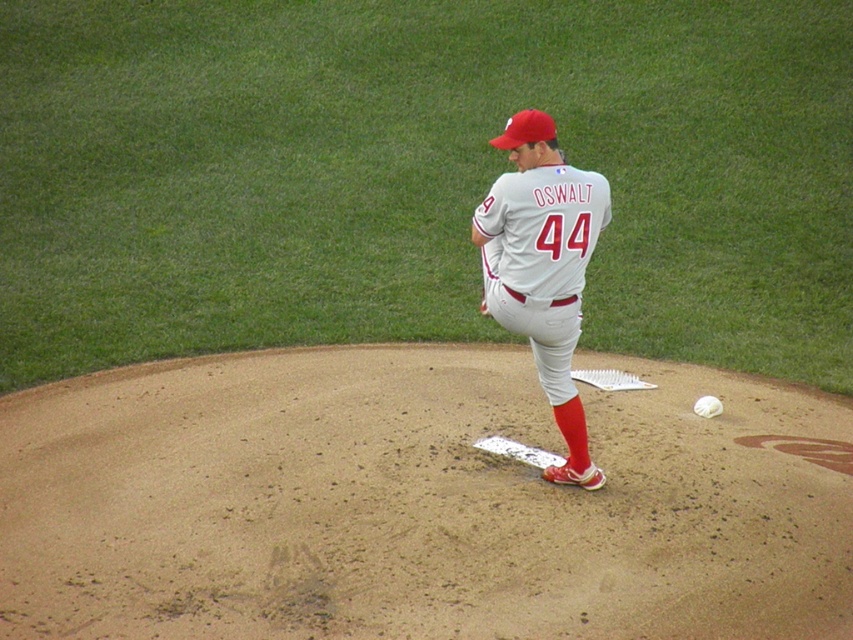
How much distance is there between brown dirt mound at center and white matte baseball at center?

The distance of brown dirt mound at center from white matte baseball at center is 1.86 meters.

Can you confirm if brown dirt mound at center is positioned to the left of white matte baseball at center?

Indeed, brown dirt mound at center is positioned on the left side of white matte baseball at center.

Describe the element at coordinates (416, 502) in the screenshot. Image resolution: width=853 pixels, height=640 pixels. I see `brown dirt mound at center` at that location.

Where is `brown dirt mound at center`? This screenshot has height=640, width=853. brown dirt mound at center is located at coordinates click(x=416, y=502).

Between brown dirt mound at center and gray fabric baseball uniform at center, which one has less height?

brown dirt mound at center

Which is more to the left, brown dirt mound at center or gray fabric baseball uniform at center?

From the viewer's perspective, brown dirt mound at center appears more on the left side.

Who is more forward, [415,387] or [577,432]?

Point [577,432] is more forward.

Locate an element on the screen. The image size is (853, 640). brown dirt mound at center is located at coordinates (416, 502).

Does gray fabric baseball uniform at center appear on the right side of white matte baseball at center?

Incorrect, gray fabric baseball uniform at center is not on the right side of white matte baseball at center.

Based on the photo, can you confirm if gray fabric baseball uniform at center is positioned below white matte baseball at center?

No, gray fabric baseball uniform at center is not below white matte baseball at center.

Is point (552, 161) less distant than point (698, 412)?

Yes, it is.

This screenshot has width=853, height=640. I want to click on gray fabric baseball uniform at center, so click(x=543, y=266).